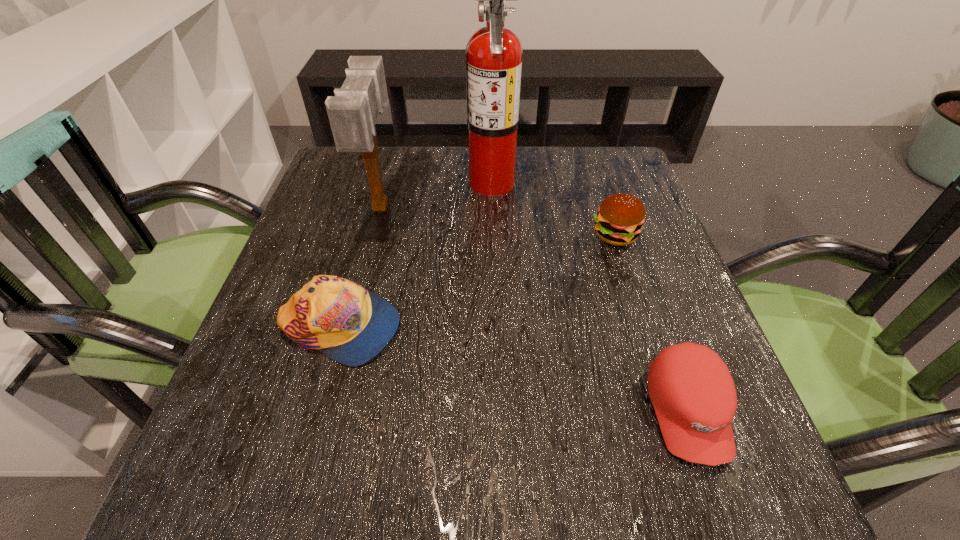
The height and width of the screenshot is (540, 960). I want to click on free location located 0.060m on the left of the hamburger, so click(563, 235).

Image resolution: width=960 pixels, height=540 pixels. I want to click on free region located on the bill of the left cap, so click(481, 327).

Where is `fire extinguisher that is at the far edge`? fire extinguisher that is at the far edge is located at coordinates (494, 54).

Image resolution: width=960 pixels, height=540 pixels. I want to click on mallet located in the far edge section of the desktop, so click(353, 111).

Locate an element on the screen. The height and width of the screenshot is (540, 960). object that is positioned at the near edge is located at coordinates (693, 394).

Where is `mallet at the left edge`? The image size is (960, 540). mallet at the left edge is located at coordinates (353, 111).

You are a GUI agent. You are given a task and a screenshot of the screen. Output one action in this format:
    pyautogui.click(x=<x>, y=<y>)
    Task: Click on the cap present at the left edge
    
    Given the screenshot: What is the action you would take?
    pyautogui.click(x=347, y=323)

Locate an element on the screen. The height and width of the screenshot is (540, 960). hamburger that is at the right edge is located at coordinates (619, 220).

Identify the location of cap located in the right edge section of the desktop. (693, 394).

This screenshot has height=540, width=960. Find the location of `object at the far left corner`. object at the far left corner is located at coordinates (353, 111).